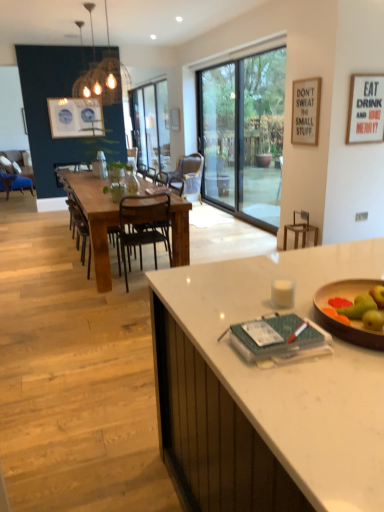
Identify the location of free space that is to the left of wooden bowl at center. Image resolution: width=384 pixels, height=512 pixels. (241, 323).